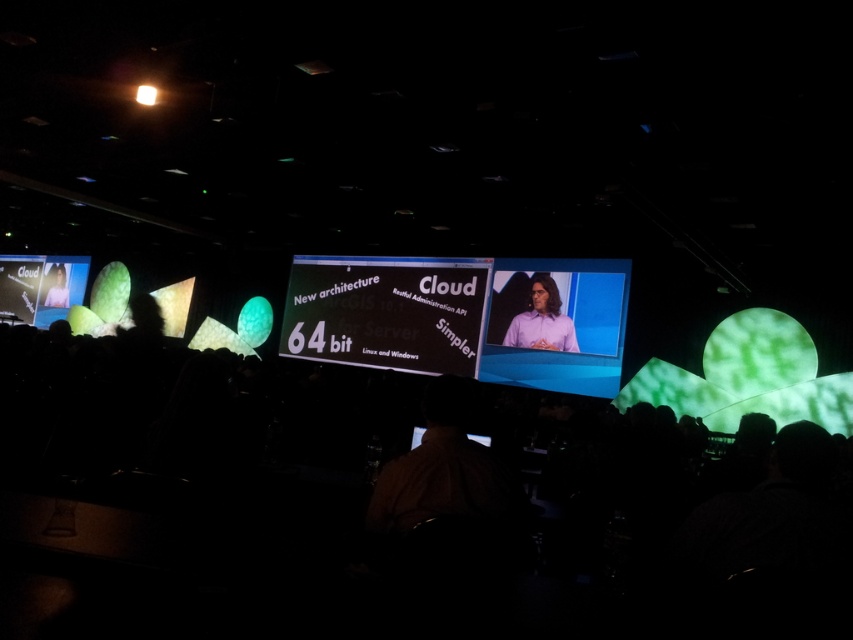
Question: Which object appears closest to the camera in this image?

Choices:
 (A) matte black screen at left
 (B) purple shirt at center
 (C) white glossy projector screen at center
 (D) brown shirt at center

Answer: (D)

Question: Does matte black screen at left lie behind matte black laptop at left?

Choices:
 (A) yes
 (B) no

Answer: (B)

Question: Does brown shirt at center have a lesser width compared to purple shirt at center?

Choices:
 (A) no
 (B) yes

Answer: (B)

Question: Which object is the closest to the purple shirt at center?

Choices:
 (A) black fabric crowd at lower center
 (B) brown shirt at center
 (C) white glossy projector screen at center
 (D) matte black laptop at left

Answer: (C)

Question: Is brown shirt at center to the right of matte black screen at left from the viewer's perspective?

Choices:
 (A) yes
 (B) no

Answer: (A)

Question: Which of the following is the farthest from the observer?

Choices:
 (A) black fabric crowd at lower center
 (B) matte black screen at left
 (C) matte black laptop at left
 (D) purple shirt at center

Answer: (C)